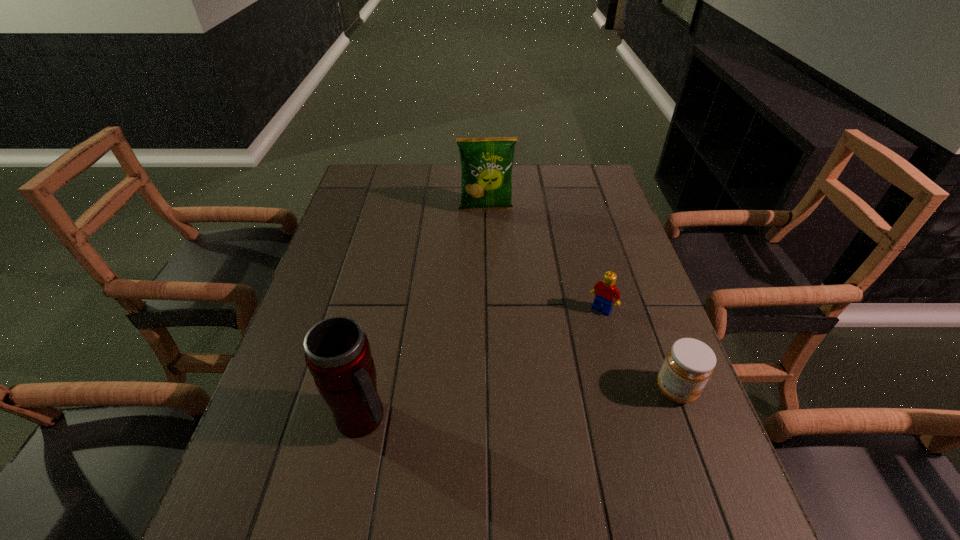
Locate an element on the screen. vacant space at the left edge of the desktop is located at coordinates (293, 426).

Identify the location of vacant area at the right edge. tap(607, 232).

In the image, there is a desktop. Where is `vacant space at the far left corner`? vacant space at the far left corner is located at coordinates (396, 188).

Find the location of a particular element. vacant space that's between the leftmost object and the Lego is located at coordinates click(483, 364).

Where is `unoccupied position between the jam and the leftmost object`? This screenshot has width=960, height=540. unoccupied position between the jam and the leftmost object is located at coordinates (519, 404).

Where is `vacant space in between the leftmost object and the Lego`? The width and height of the screenshot is (960, 540). vacant space in between the leftmost object and the Lego is located at coordinates (483, 364).

Locate an element on the screen. The image size is (960, 540). free space between the leftmost object and the farthest object is located at coordinates (424, 314).

Find the location of `free space that is in between the farthest object and the thermos bottle`. free space that is in between the farthest object and the thermos bottle is located at coordinates (424, 314).

I want to click on vacant point located between the third nearest object and the farthest object, so click(544, 260).

You are a GUI agent. You are given a task and a screenshot of the screen. Output one action in this format:
    pyautogui.click(x=<x>, y=<y>)
    Task: Click on the vacant space that is in between the farthest object and the jam
    
    Given the screenshot: What is the action you would take?
    pyautogui.click(x=581, y=300)